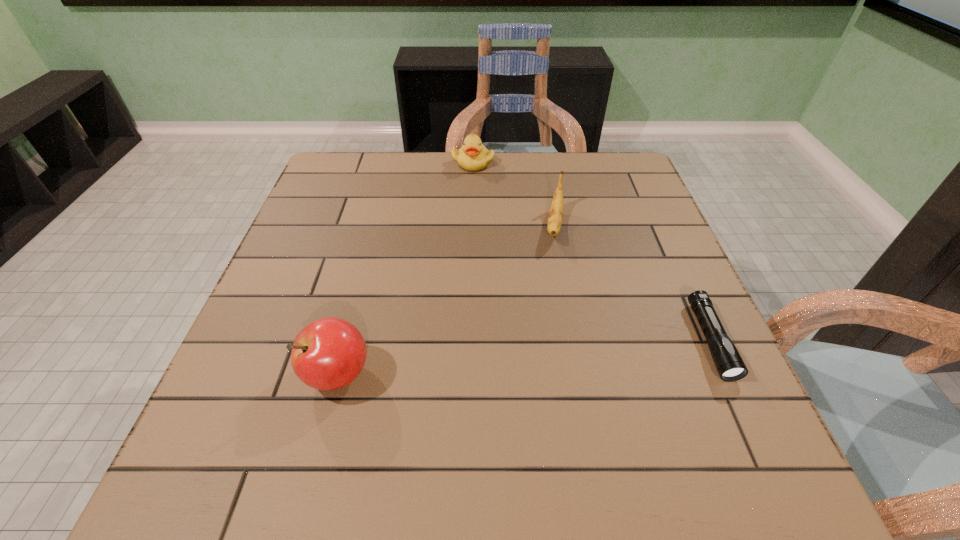
Find the location of a particular element. This screenshot has height=540, width=960. free space between the farthest object and the leftmost object is located at coordinates (405, 268).

Identify the location of empty location between the rightmost object and the third nearest object. This screenshot has height=540, width=960. [632, 282].

Where is `unoccupied position between the farthest object and the leftmost object`? unoccupied position between the farthest object and the leftmost object is located at coordinates (405, 268).

I want to click on free space between the second object from left to right and the banana, so click(x=514, y=193).

You are a GUI agent. You are given a task and a screenshot of the screen. Output one action in this format:
    pyautogui.click(x=<x>, y=<y>)
    Task: Click on the free space that is in between the flashlight and the third nearest object
    
    Given the screenshot: What is the action you would take?
    pyautogui.click(x=632, y=282)

Identify the location of free space between the rightmost object and the duckling. (591, 251).

The image size is (960, 540). Identify the location of unoccupied area between the apple and the second object from right to left. (445, 300).

I want to click on the third closest object to the duckling, so click(730, 366).

At what (x,y) coordinates should I click in order to perform the action: click on the second closest object to the duckling. Please return your answer as a coordinate pair (x, y). Looking at the image, I should click on (329, 353).

Find the location of a particular element. This screenshot has width=960, height=540. vacant space that satisfies the following two spatial constraints: 1. on the back side of the apple; 2. on the right side of the farthest object is located at coordinates (394, 162).